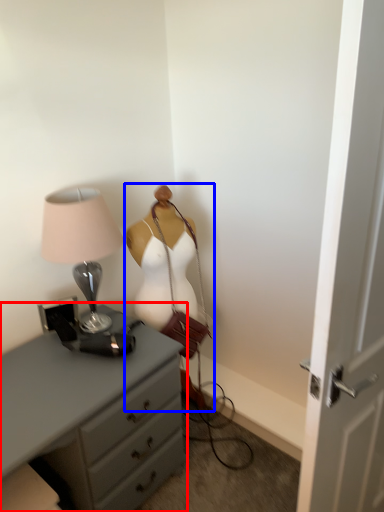
Question: Which object is closer to the camera taking this photo, chest of drawers (highlighted by a red box) or mannequin (highlighted by a blue box)?

Choices:
 (A) chest of drawers
 (B) mannequin

Answer: (A)